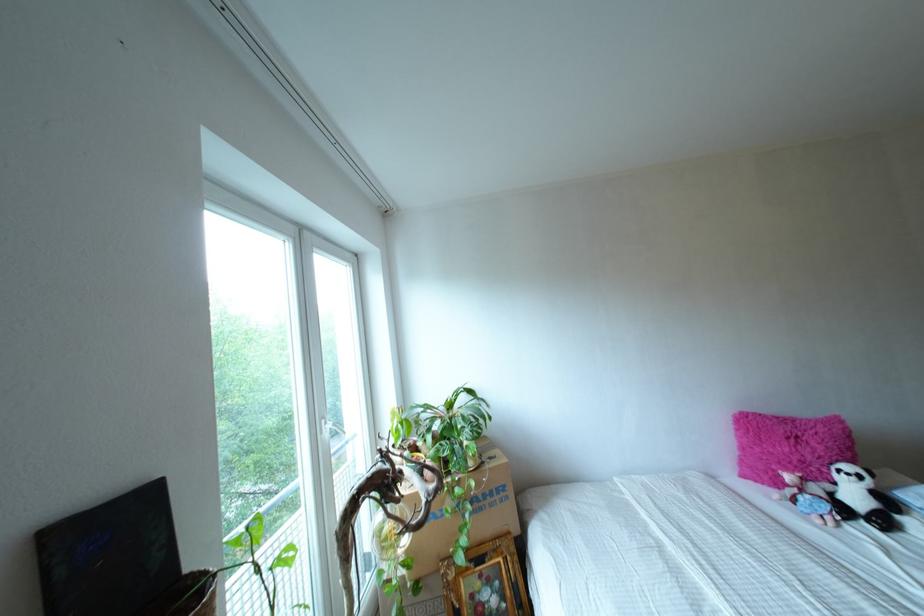
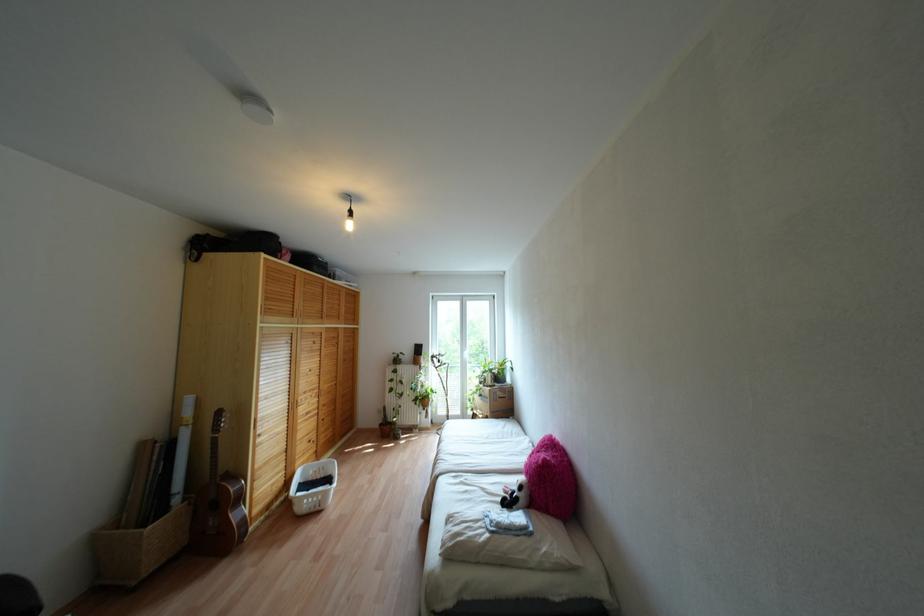
Find the pixel in the second image that matches point (886, 553) in the first image.

(482, 488)